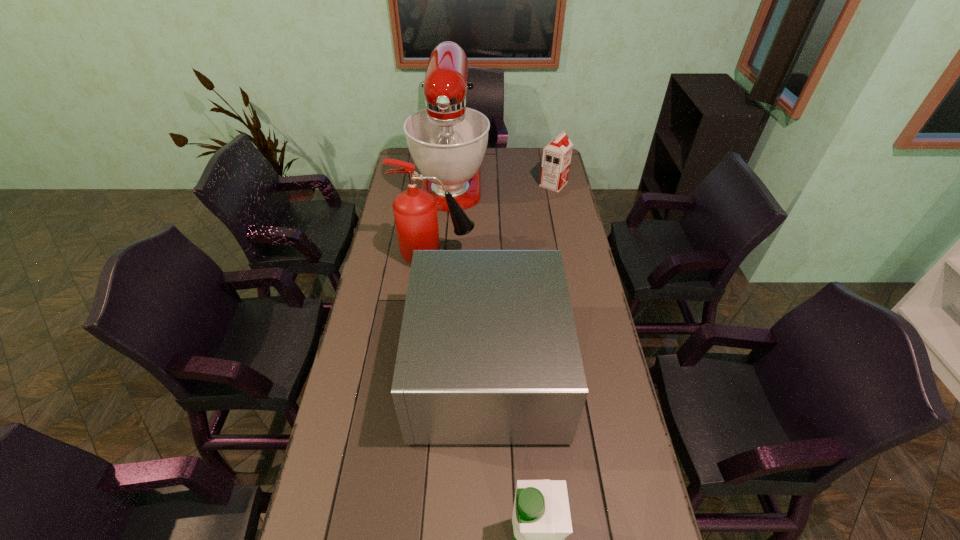
You are a GUI agent. You are given a task and a screenshot of the screen. Output one action in this format:
    pyautogui.click(x=<x>, y=<y>)
    Task: Click on the vacant space at the far right corner of the desktop
    The width and height of the screenshot is (960, 540).
    Given the screenshot: What is the action you would take?
    pyautogui.click(x=539, y=150)

You are a GUI agent. You are given a task and a screenshot of the screen. Output one action in this format:
    pyautogui.click(x=<x>, y=<y>)
    Task: Click on the free area in between the rightmost object and the mixer
    
    Given the screenshot: What is the action you would take?
    pyautogui.click(x=502, y=182)

The width and height of the screenshot is (960, 540). Identify the location of free space between the rightmost object and the fire extinguisher. 495,220.

Locate an element on the screen. unoccupied area between the fire extinguisher and the farther soya milk is located at coordinates pyautogui.click(x=495, y=220).

You are a GUI agent. You are given a task and a screenshot of the screen. Output one action in this format:
    pyautogui.click(x=<x>, y=<y>)
    Task: Click on the object that is the fourth closest to the nearer soya milk
    This screenshot has height=540, width=960.
    Given the screenshot: What is the action you would take?
    pyautogui.click(x=556, y=159)

Locate an element on the screen. The width and height of the screenshot is (960, 540). object that is the third closest one to the microwave oven is located at coordinates (447, 140).

Locate which soya milk is the second closest to the tallest object. Please provide its 2D coordinates. Your answer should be formatted as a tuple, i.e. [(x, y)], where the tuple contains the x and y coordinates of a point satisfying the conditions above.

[(541, 520)]

Find the location of a particular element. The width and height of the screenshot is (960, 540). vacant area that satisfies the following two spatial constraints: 1. on the front side of the rightmost object; 2. with the door open on the microwave oven is located at coordinates (592, 369).